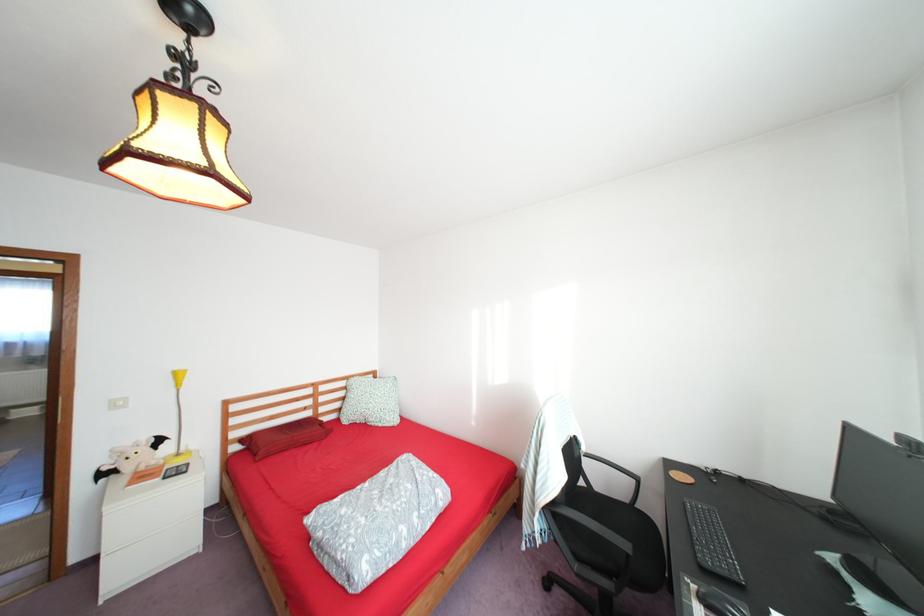
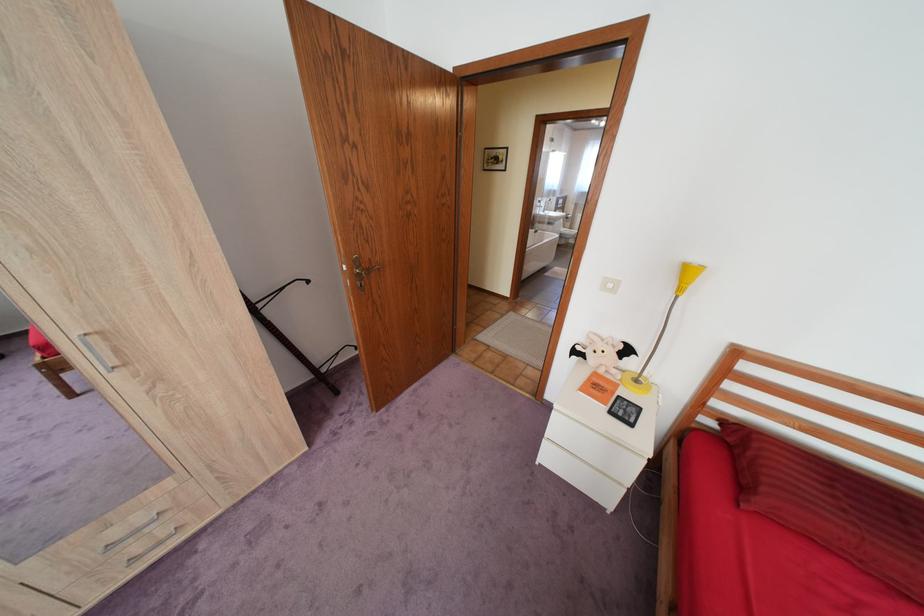
Where in the second image is the point corresponding to the point at 148,472 from the first image?

(606, 373)